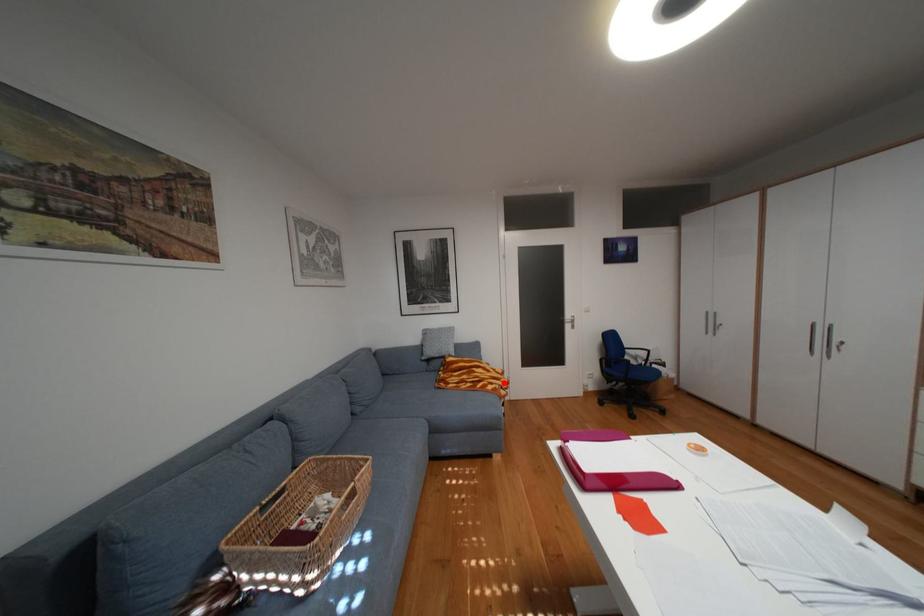
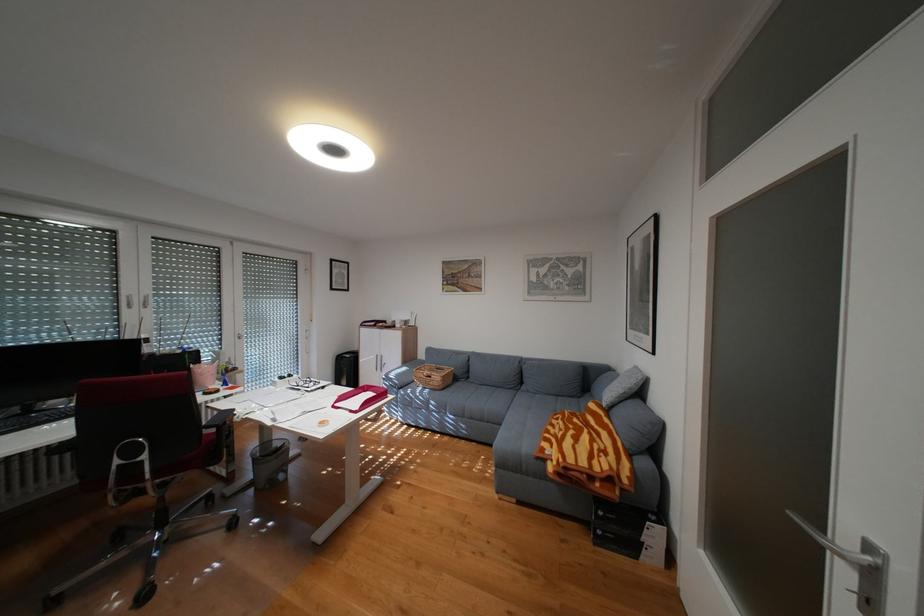
Locate, in the second image, the point that corresponds to the highlighted location in the first image.

(564, 445)